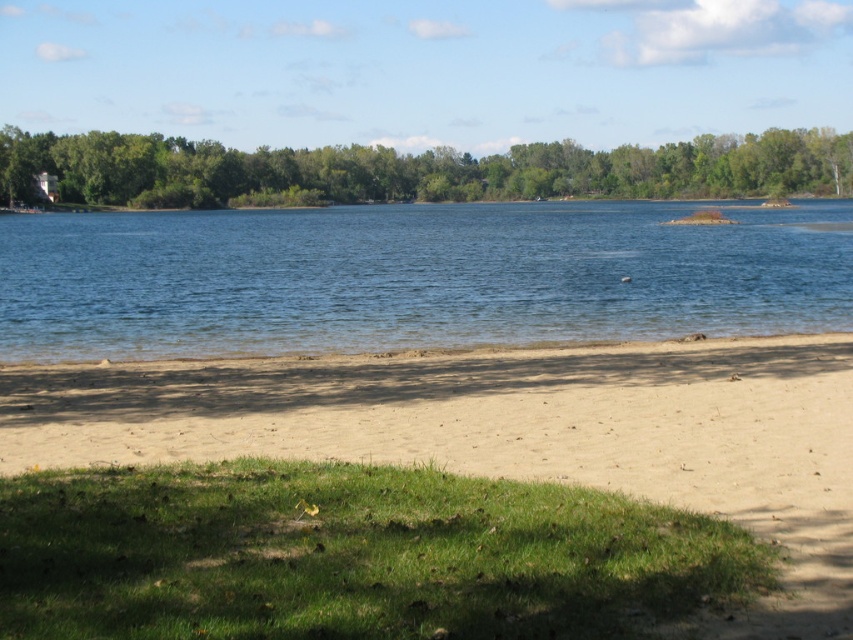
What do you see at coordinates (413, 276) in the screenshot? I see `blue water at center` at bounding box center [413, 276].

Who is more forward, (x=135, y=230) or (x=799, y=136)?

Positioned in front is point (x=135, y=230).

This screenshot has width=853, height=640. I want to click on blue water at center, so 413,276.

Between light brown sandy beach at lower center and blue water at center, which one is positioned lower?

light brown sandy beach at lower center

Between light brown sandy beach at lower center and blue water at center, which one appears on the right side from the viewer's perspective?

From the viewer's perspective, blue water at center appears more on the right side.

Which is in front, point (741, 513) or point (230, 257)?

Positioned in front is point (741, 513).

Where is `light brown sandy beach at lower center`? This screenshot has width=853, height=640. light brown sandy beach at lower center is located at coordinates (509, 432).

Does light brown sandy beach at lower center have a greater width compared to green leafy tree at upper center?

No, light brown sandy beach at lower center is not wider than green leafy tree at upper center.

This screenshot has height=640, width=853. What do you see at coordinates (509, 432) in the screenshot?
I see `light brown sandy beach at lower center` at bounding box center [509, 432].

What are the coordinates of `light brown sandy beach at lower center` in the screenshot? It's located at (509, 432).